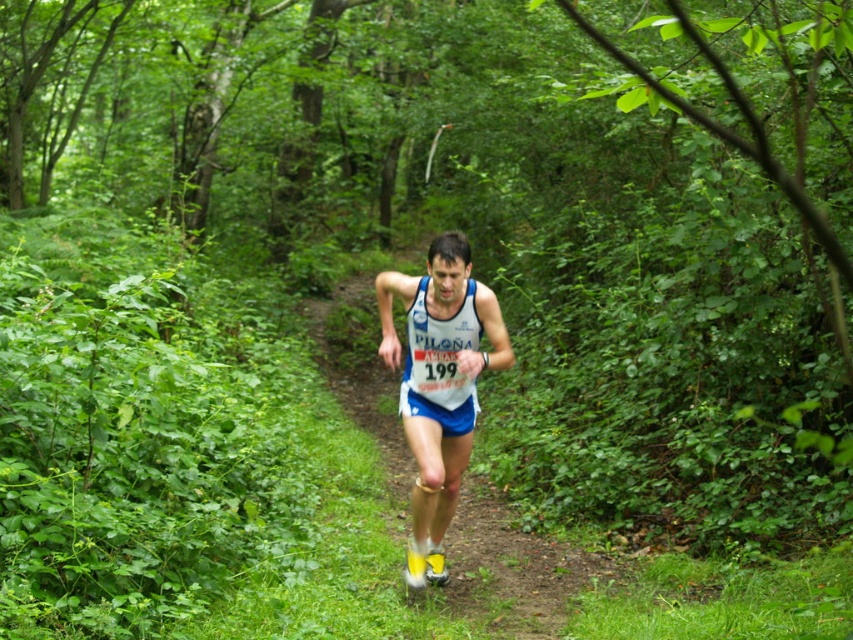
You are a race official at the starting line of a 5K race. You need to ensure that all runners are properly spaced for safety. The safety guideline requires at least 2 meters between runners. Looking at the image, are the blue fabric runner at center and white fabric runner at center meeting the safety requirement?

The distance between the blue fabric runner at center and the white fabric runner at center is 2.30 meters, which exceeds the required 2 meters. Therefore, they are meeting the safety requirement.

You are a photographer at the finish line of a marathon. You see the blue fabric runner at center and the white fabric runner at center approaching. Which runner will you need to prepare to capture first based on their sizes?

The blue fabric runner at center is larger in size than the white fabric runner at center, so they will appear closer and should be captured first.

You are a photographer positioned at the starting line of the race. You need to capture both the blue fabric runner at center and the white fabric runner at center in a single photo. Which runner should you focus on first to ensure both are in frame?

You should focus on the blue fabric runner at center first because it is taller than the white fabric runner at center, ensuring both are visible in the frame.